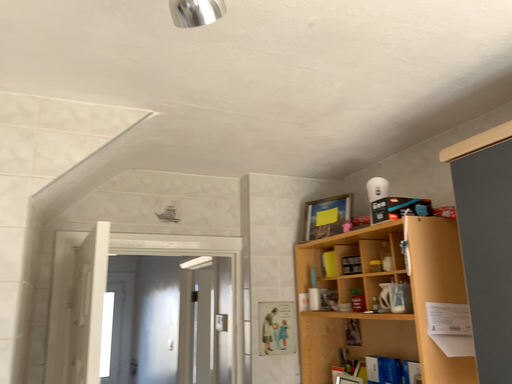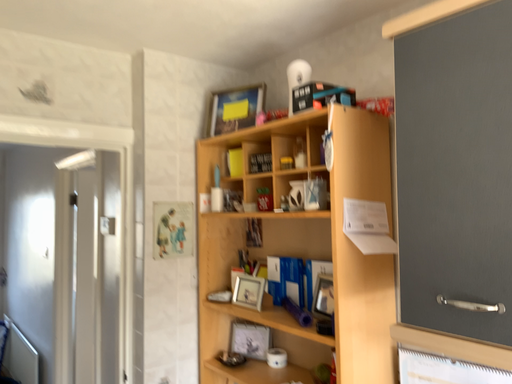
Question: Which way did the camera rotate in the video?

Choices:
 (A) rotated upward
 (B) rotated downward

Answer: (B)